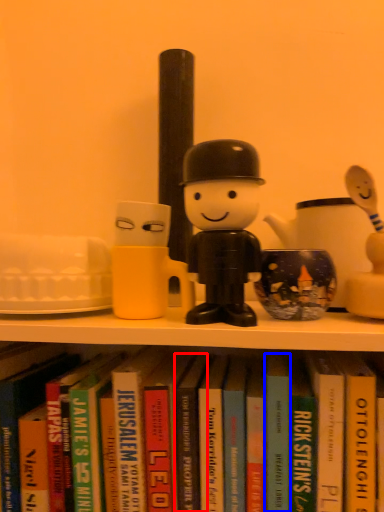
Question: Which point is closer to the camera, paperback book (highlighted by a red box) or paperback book (highlighted by a blue box)?

Choices:
 (A) paperback book
 (B) paperback book

Answer: (B)